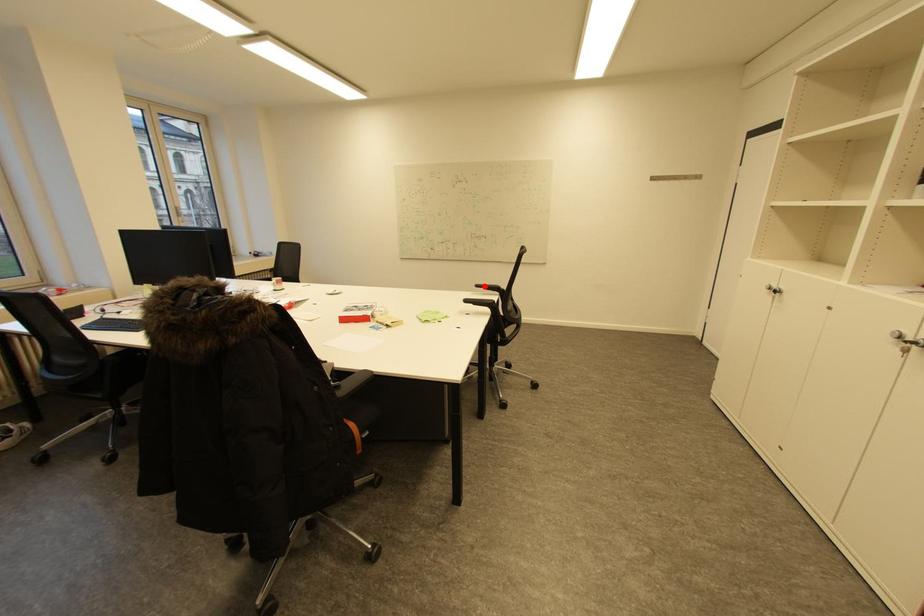
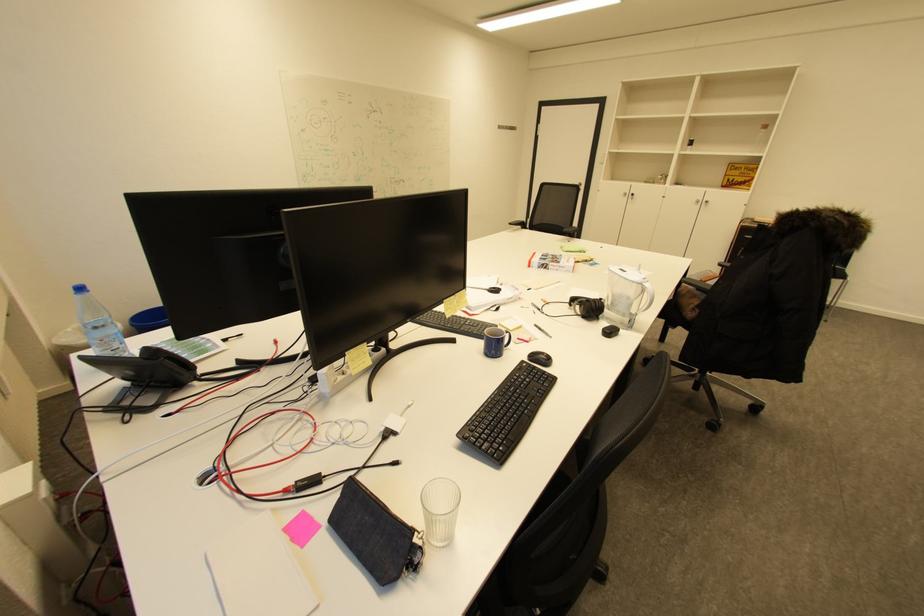
The point at the highlighted location is marked in the first image. Where is the corresponding point in the second image?

(517, 225)